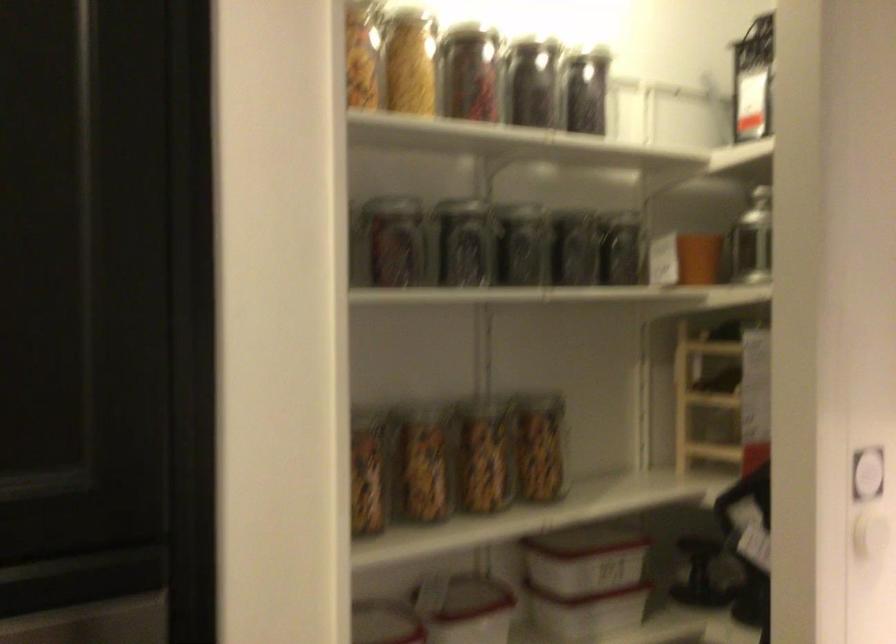
Find the location of a particular element. Image resolution: width=896 pixels, height=644 pixels. white circular button is located at coordinates (867, 474).